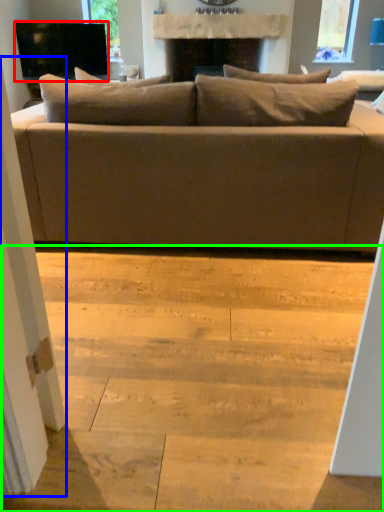
Question: Estimate the real-world distances between objects in this image. Which object is farther from television (highlighted by a red box), screen door (highlighted by a blue box) or stair (highlighted by a green box)?

Choices:
 (A) screen door
 (B) stair

Answer: (A)